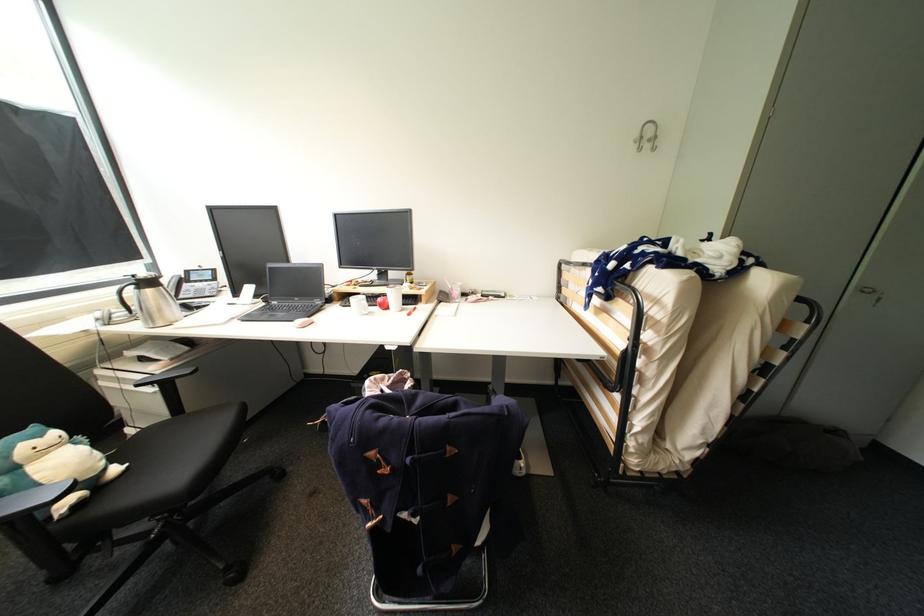
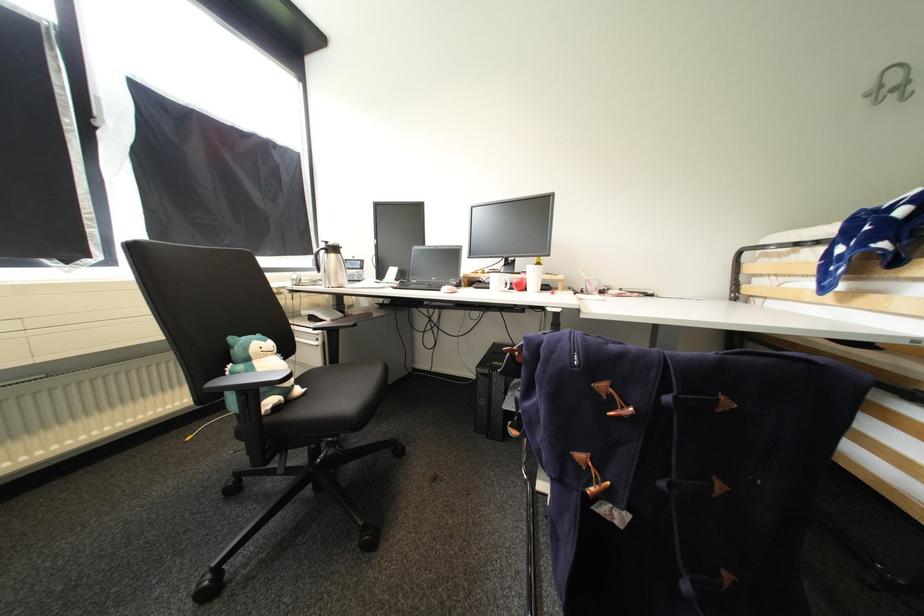
In the second image, find the point that corresponds to point (49, 438) in the first image.

(272, 342)